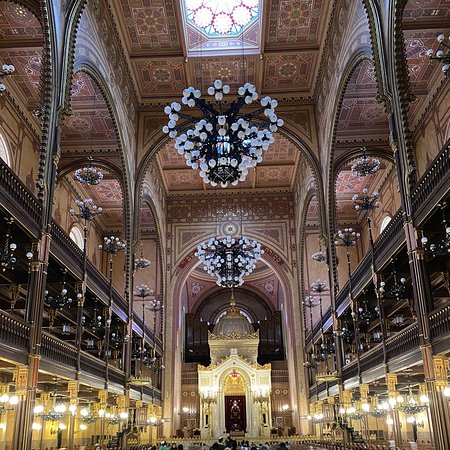
This screenshot has width=450, height=450. Identify the location of brown wall hanging. (239, 422).